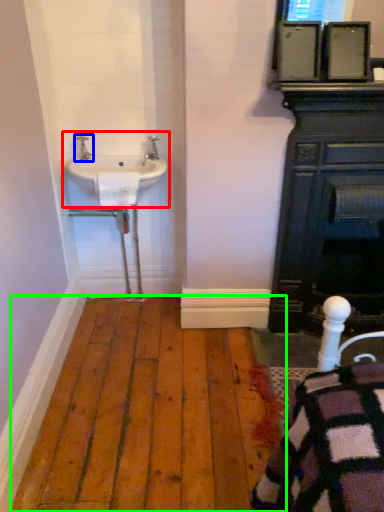
Question: Estimate the real-world distances between objects in this image. Which object is farther from sink (highlighted by a red box), tap (highlighted by a blue box) or hardwood (highlighted by a green box)?

Choices:
 (A) tap
 (B) hardwood

Answer: (B)